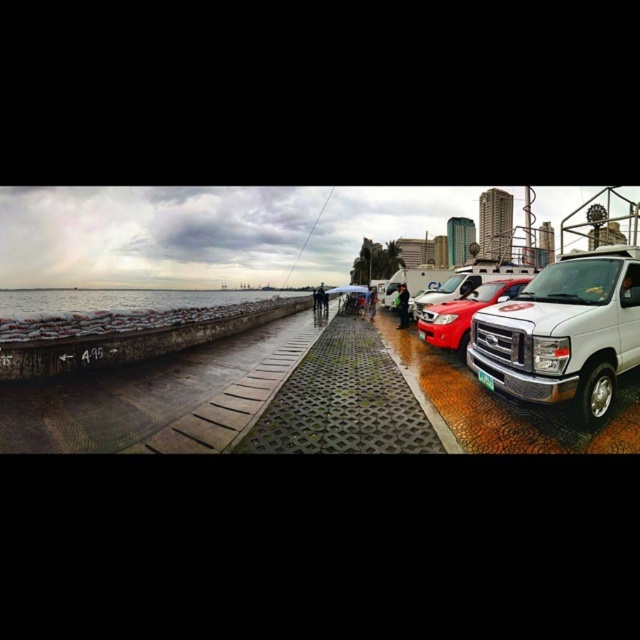
Is concrete textured pavement at lower left wider than green plastic license plate at center?

Yes.

Could you measure the distance between concrete textured pavement at lower left and green plastic license plate at center?

6.47 meters

Is point (54, 448) closer to viewer compared to point (480, 371)?

Yes, it is.

The width and height of the screenshot is (640, 640). I want to click on concrete textured pavement at lower left, so click(x=156, y=397).

Is the position of matte white van at right less distant than that of green plastic license plate at center?

No.

Does point (440, 301) lie behind point (492, 388)?

Yes, point (440, 301) is farther from viewer.

Which is in front, point (422, 307) or point (483, 372)?

Positioned in front is point (483, 372).

This screenshot has height=640, width=640. Find the location of `matte white van at right`. matte white van at right is located at coordinates (467, 282).

Who is higher up, green textured pavement at center or green plastic license plate at center?

green plastic license plate at center is above.

Is green textured pavement at center closer to the viewer compared to green plastic license plate at center?

No, green textured pavement at center is further to the viewer.

This screenshot has width=640, height=640. I want to click on green textured pavement at center, so click(348, 401).